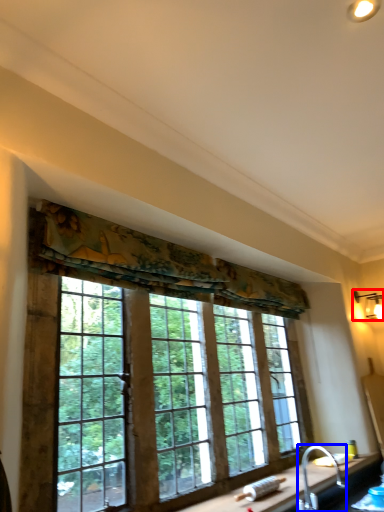
Question: Which of the following is the farthest to the observer, light fixture (highlighted by a red box) or faucet (highlighted by a blue box)?

Choices:
 (A) light fixture
 (B) faucet

Answer: (A)